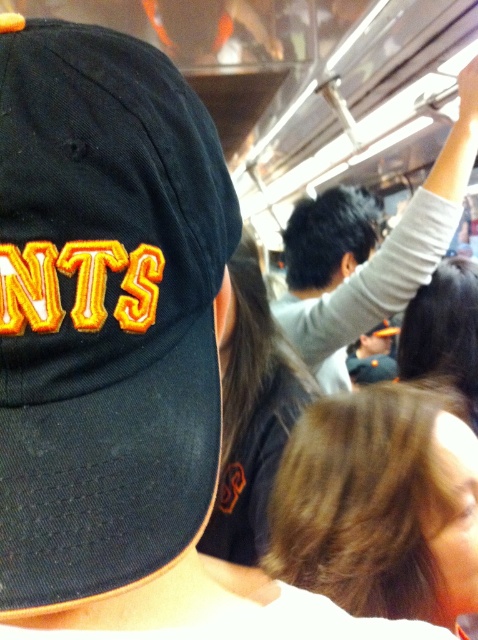
Does point (54, 262) lie in front of point (438, 609)?

Yes.

Which is behind, point (42, 275) or point (366, 596)?

Positioned behind is point (366, 596).

Find the location of a particular element. This screenshot has height=640, width=478. navy blue fabric baseball cap at left is located at coordinates (104, 312).

Is brown hair at center wider than gray fabric shirt at upper right?

Incorrect, brown hair at center's width does not surpass gray fabric shirt at upper right's.

This screenshot has height=640, width=478. What do you see at coordinates (380, 504) in the screenshot? I see `brown hair at center` at bounding box center [380, 504].

Image resolution: width=478 pixels, height=640 pixels. In order to click on brown hair at center in this screenshot , I will do `click(380, 504)`.

Where is `brown hair at center`? This screenshot has width=478, height=640. brown hair at center is located at coordinates (380, 504).

Can you confirm if navy blue fabric baseball cap at left is shorter than gray fabric shirt at upper right?

Yes, navy blue fabric baseball cap at left is shorter than gray fabric shirt at upper right.

Is navy blue fabric baseball cap at left in front of gray fabric shirt at upper right?

Yes, navy blue fabric baseball cap at left is in front of gray fabric shirt at upper right.

Between point (94, 332) and point (404, 284), which one is positioned in front?

Positioned in front is point (94, 332).

Image resolution: width=478 pixels, height=640 pixels. In order to click on navy blue fabric baseball cap at left in this screenshot , I will do `click(104, 312)`.